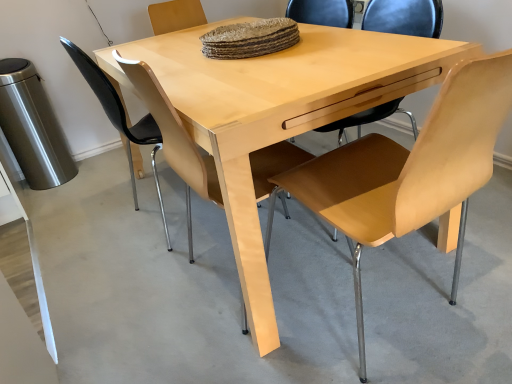
Find the location of a particular element. free space in front of brown woven mat at center is located at coordinates (271, 69).